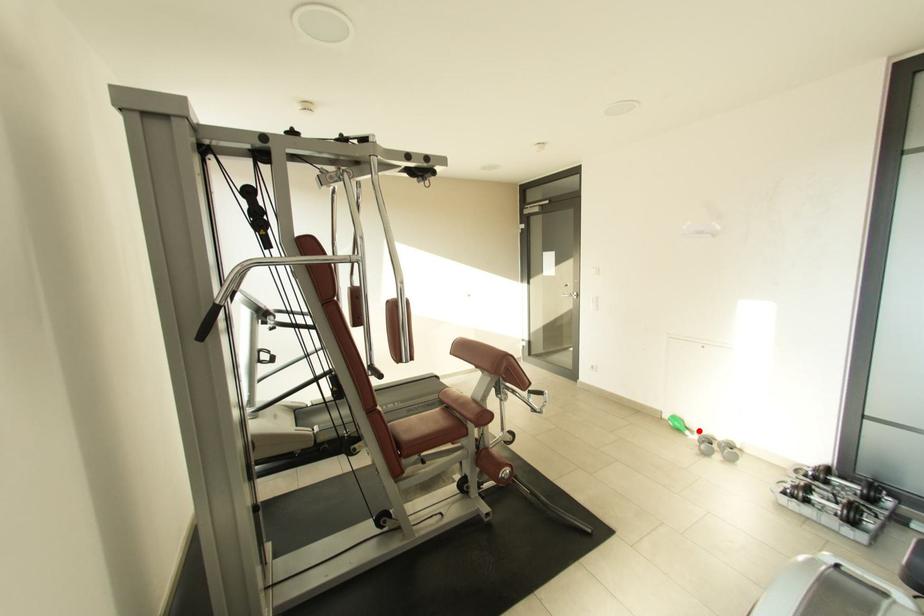
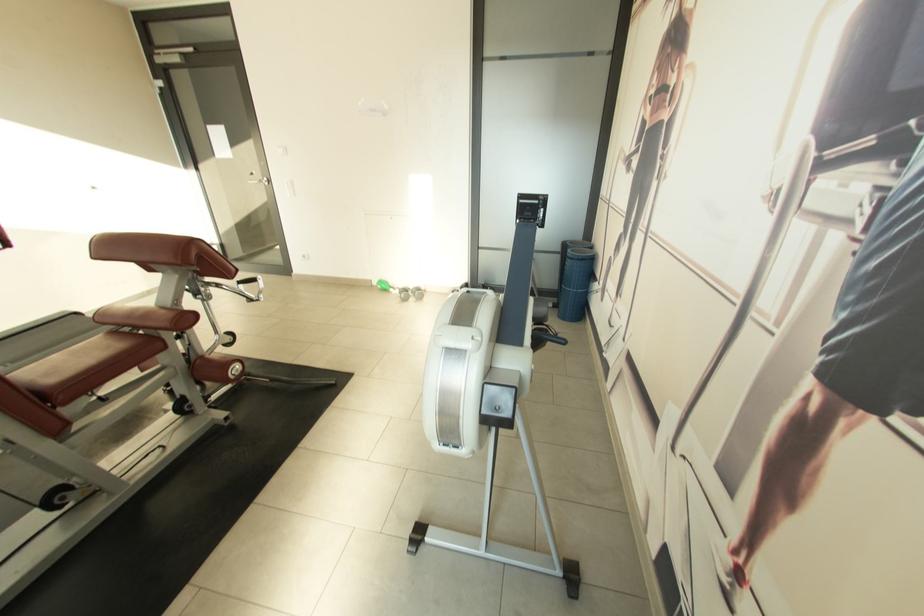
Question: A red point is marked in image1. In image2, is the corresponding 3D point closer to the camera or farther? Reply with the corresponding letter.

Choices:
 (A) The corresponding 3D point is closer.
 (B) The corresponding 3D point is farther.

Answer: (A)